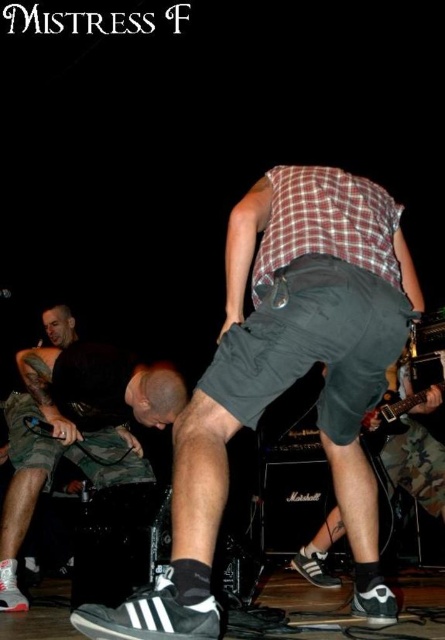
You are a photographer at the live music performance. You want to capture a photo that includes both the camouflage shorts at lower left and the electric guitar at lower right. Based on their positions, which object should be placed closer to the center of the frame to ensure both are clearly visible?

The camouflage shorts at lower left should be placed closer to the center of the frame because they are wider than the electric guitar at lower right, allowing both to fit within the frame more effectively.

In the scene shown: You are a photographer at the live music performance. You want to capture a photo that includes both the camouflage shorts at lower left and the electric guitar at lower right. Based on their positions, which object should you focus on first to ensure both are in frame?

The camouflage shorts at lower left is located below the electric guitar at lower right. To include both in the frame, focus on the electric guitar at lower right first since it is higher up, allowing the camera to capture the lower positioned camouflage shorts at lower left naturally within the same shot.